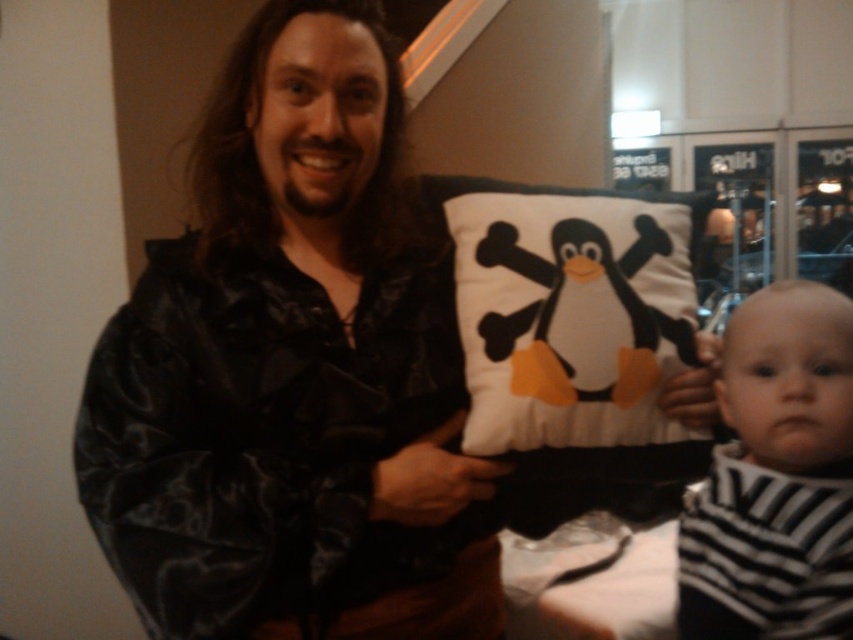
Question: Can you confirm if white fabric pillow at center is positioned below black and white striped bib at lower right?

Choices:
 (A) yes
 (B) no

Answer: (B)

Question: Among these points, which one is farthest from the camera?

Choices:
 (A) (448, 182)
 (B) (802, 470)

Answer: (A)

Question: Which point is closer to the camera?

Choices:
 (A) (672, 218)
 (B) (729, 324)

Answer: (B)

Question: Is the position of white fabric pillow at center more distant than that of black and white striped bib at lower right?

Choices:
 (A) yes
 (B) no

Answer: (A)

Question: Is white fabric pillow at center in front of black and white striped bib at lower right?

Choices:
 (A) yes
 (B) no

Answer: (B)

Question: Which point is closer to the camera?

Choices:
 (A) white fabric pillow at center
 (B) black and white striped bib at lower right

Answer: (B)